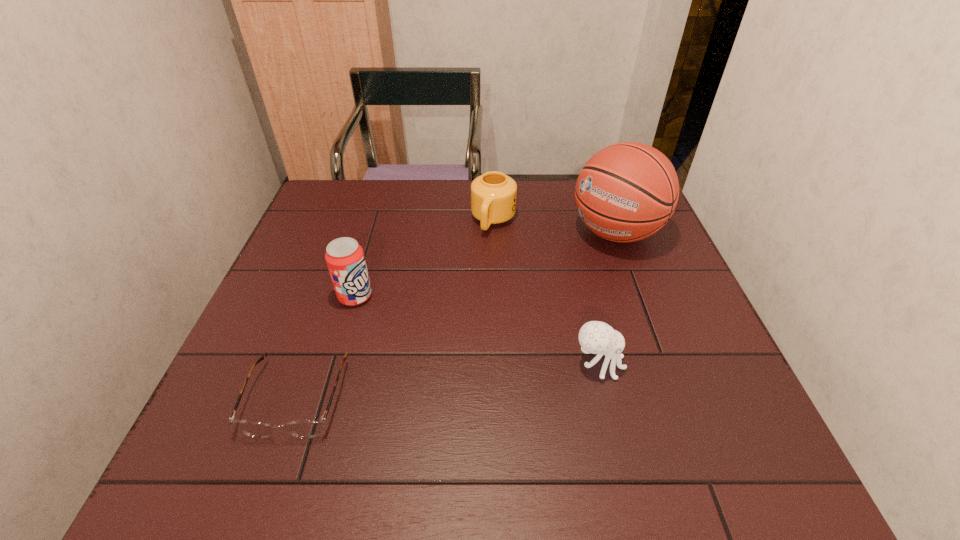
Where is `empty space between the shortest object and the third object from left to right`? The height and width of the screenshot is (540, 960). empty space between the shortest object and the third object from left to right is located at coordinates (396, 309).

This screenshot has height=540, width=960. What are the coordinates of `free space between the soda can and the basketball` in the screenshot? It's located at (486, 264).

I want to click on free space between the basketball and the soda can, so click(486, 264).

Identify the location of free space between the spectacles and the soda can. (326, 347).

I want to click on vacant area between the third farthest object and the shortest object, so click(x=326, y=347).

Image resolution: width=960 pixels, height=540 pixels. Find the location of `vacant area that lies between the third object from left to right and the spectacles`. vacant area that lies between the third object from left to right and the spectacles is located at coordinates 396,309.

This screenshot has height=540, width=960. I want to click on unoccupied area between the third nearest object and the shortest object, so click(x=326, y=347).

Identify the location of vacant space that is in between the third object from left to right and the soda can. The width and height of the screenshot is (960, 540). (424, 258).

The height and width of the screenshot is (540, 960). I want to click on the fourth closest object relative to the shortest object, so click(626, 192).

Select which object is the second closest to the third farthest object. Please provide its 2D coordinates. Your answer should be formatted as a tuple, i.e. [(x, y)], where the tuple contains the x and y coordinates of a point satisfying the conditions above.

[(493, 195)]